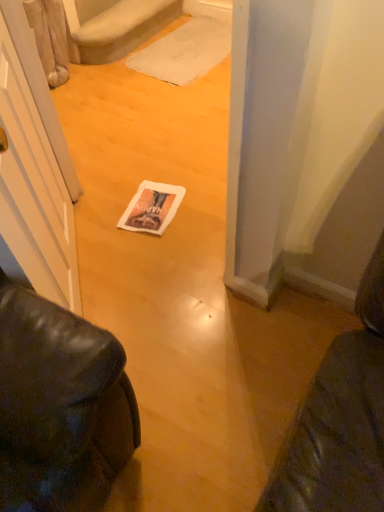
Question: Is white paper magazine at center oriented away from white fabric doormat at center?

Choices:
 (A) yes
 (B) no

Answer: (A)

Question: Is white paper magazine at center behind white fabric doormat at center?

Choices:
 (A) no
 (B) yes

Answer: (A)

Question: From the image's perspective, is white paper magazine at center beneath white fabric doormat at center?

Choices:
 (A) yes
 (B) no

Answer: (A)

Question: Considering the relative positions of white paper magazine at center and white fabric doormat at center in the image provided, is white paper magazine at center in front of white fabric doormat at center?

Choices:
 (A) yes
 (B) no

Answer: (A)

Question: Does white paper magazine at center appear on the left side of white fabric doormat at center?

Choices:
 (A) no
 (B) yes

Answer: (B)

Question: Would you say white fabric doormat at center is to the left or to the right of white plush carpet at upper center in the picture?

Choices:
 (A) left
 (B) right

Answer: (B)

Question: From a real-world perspective, is white fabric doormat at center positioned above or below white plush carpet at upper center?

Choices:
 (A) below
 (B) above

Answer: (A)

Question: Considering the positions of white fabric doormat at center and white plush carpet at upper center in the image, is white fabric doormat at center taller or shorter than white plush carpet at upper center?

Choices:
 (A) tall
 (B) short

Answer: (B)

Question: Looking at the image, does white fabric doormat at center seem bigger or smaller compared to white plush carpet at upper center?

Choices:
 (A) big
 (B) small

Answer: (B)

Question: From their relative heights in the image, would you say white plush carpet at upper center is taller or shorter than white fabric doormat at center?

Choices:
 (A) short
 (B) tall

Answer: (B)

Question: Is white plush carpet at upper center to the left or to the right of white fabric doormat at center in the image?

Choices:
 (A) left
 (B) right

Answer: (A)

Question: Is point (69, 2) closer or farther from the camera than point (185, 27)?

Choices:
 (A) closer
 (B) farther

Answer: (A)

Question: From a real-world perspective, is white plush carpet at upper center above or below white fabric doormat at center?

Choices:
 (A) above
 (B) below

Answer: (A)

Question: Considering the positions of white paper magazine at center and white plush carpet at upper center in the image, is white paper magazine at center taller or shorter than white plush carpet at upper center?

Choices:
 (A) short
 (B) tall

Answer: (A)

Question: Considering the positions of point (152, 201) and point (122, 53), is point (152, 201) closer or farther from the camera than point (122, 53)?

Choices:
 (A) farther
 (B) closer

Answer: (B)